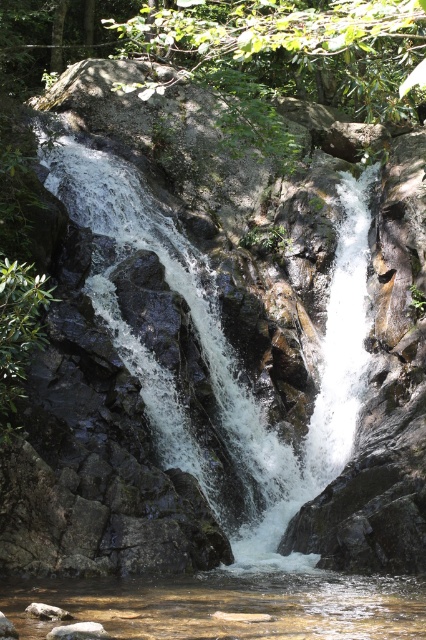
Measure the distance between white frothy water at center and camera.

white frothy water at center and camera are 61.07 feet apart.

Who is more distant from viewer, (328, 323) or (276, 624)?

Point (328, 323)

This screenshot has width=426, height=640. Identify the location of white frothy water at center. (227, 353).